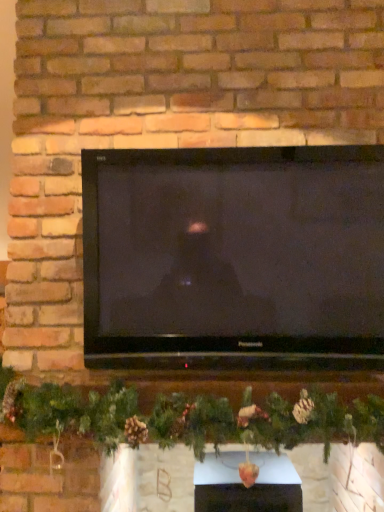
Question: From a real-world perspective, is black glossy tv at center above or below white glossy fireplace at center?

Choices:
 (A) below
 (B) above

Answer: (B)

Question: In the image, is black glossy tv at center positioned in front of or behind white glossy fireplace at center?

Choices:
 (A) behind
 (B) front

Answer: (B)

Question: Which is nearer to the black glossy tv at center?

Choices:
 (A) white glossy fireplace at center
 (B) green matte garland at center

Answer: (B)

Question: Which object is the farthest from the green matte garland at center?

Choices:
 (A) black glossy tv at center
 (B) white glossy fireplace at center

Answer: (B)